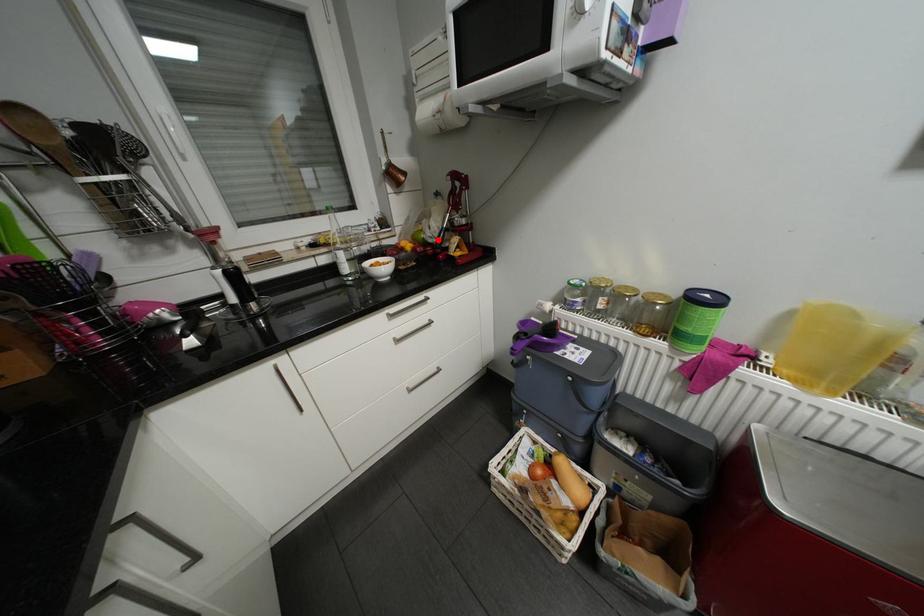
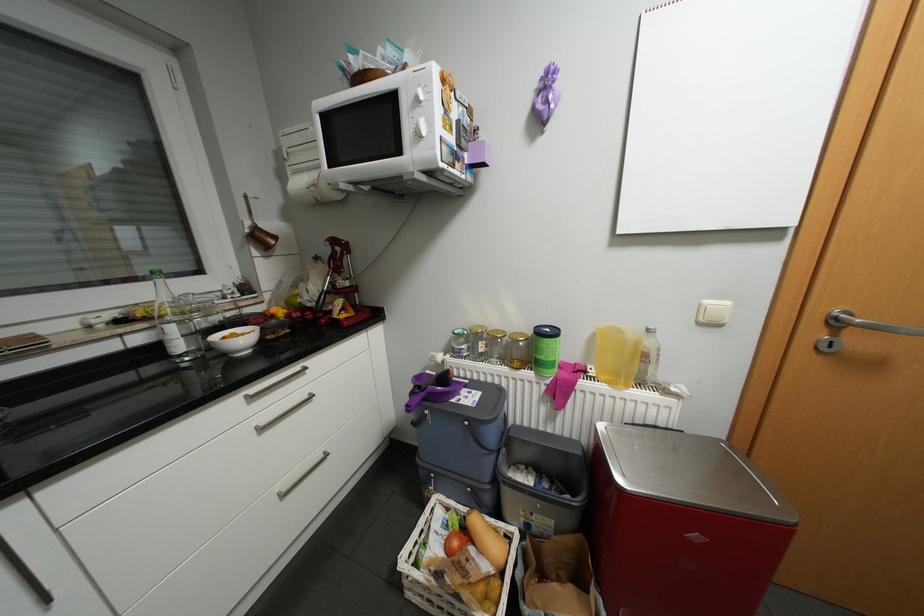
The point at the highlighted location is marked in the first image. Where is the corresponding point in the second image?

(317, 304)